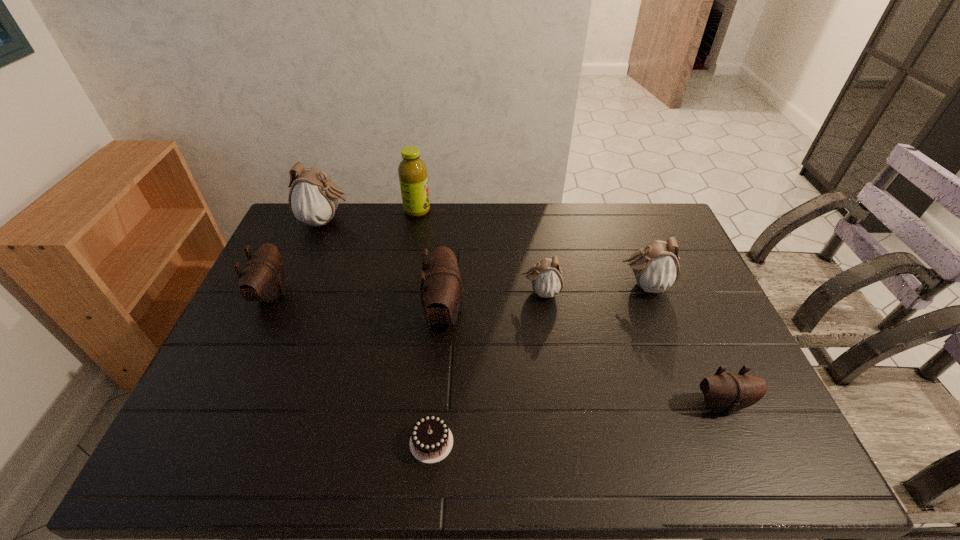
This screenshot has width=960, height=540. What are the coordinates of `vacant space at the near edge` in the screenshot? It's located at (644, 441).

Find the location of a particular element. This screenshot has width=960, height=540. vacant area at the left edge is located at coordinates [x=225, y=395].

Locate an element on the screen. vacant region at the far left corner of the desktop is located at coordinates point(332,218).

Where is `free region at the near left corner of the desktop`? The width and height of the screenshot is (960, 540). free region at the near left corner of the desktop is located at coordinates (215, 445).

Find the location of a particular element. This screenshot has width=960, height=540. free space at the far right corner of the desktop is located at coordinates (631, 224).

The height and width of the screenshot is (540, 960). I want to click on free area in between the second nearest object and the second biggest brown pouch, so click(496, 349).

Identify the location of free area in between the second brown pouch from left to right and the farthest white pouch. (385, 267).

In order to click on free space between the fourth pouch from right to left and the rightmost white pouch in this screenshot , I will do `click(544, 299)`.

Find the location of a particular element. This screenshot has width=960, height=540. free area in between the second smallest brown pouch and the biggest brown pouch is located at coordinates (358, 303).

Image resolution: width=960 pixels, height=540 pixels. I want to click on free space between the second white pouch from left to right and the biggest brown pouch, so click(492, 302).